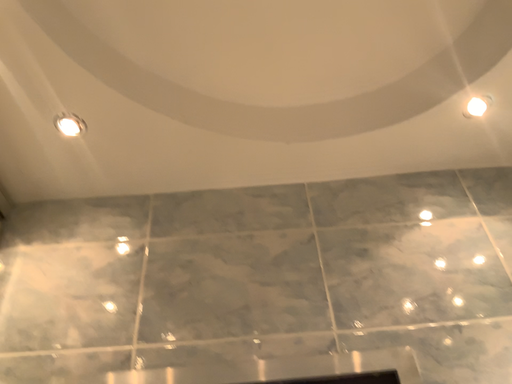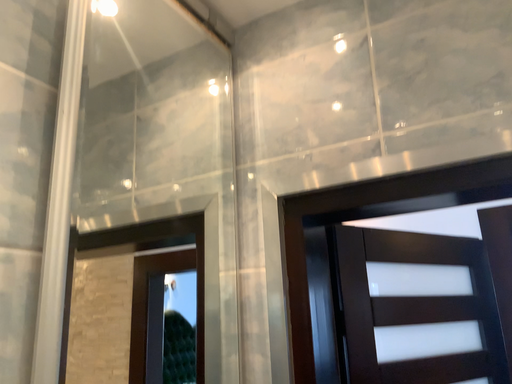
Question: How did the camera likely rotate when shooting the video?

Choices:
 (A) rotated right
 (B) rotated left

Answer: (B)